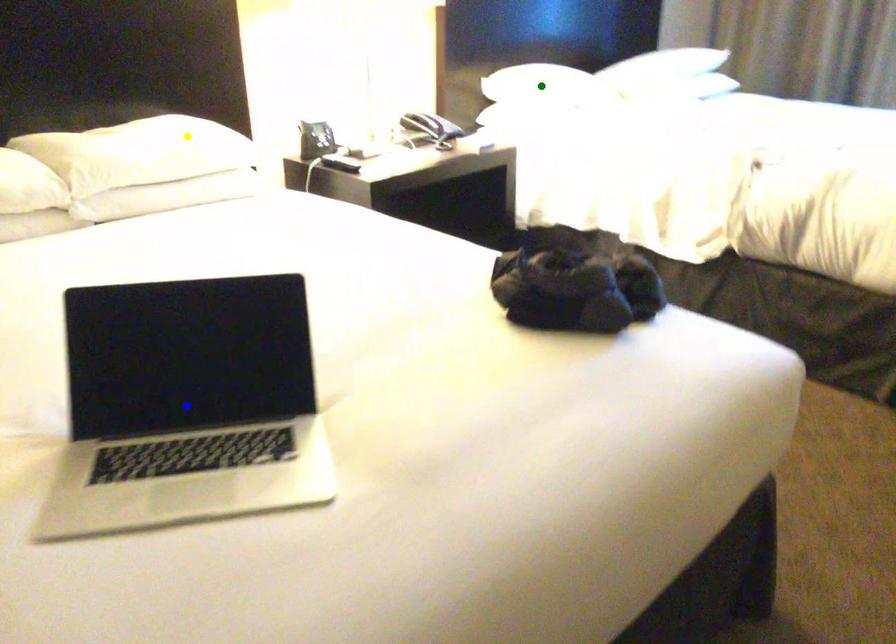
Order these from nearest to farthest:
yellow point | blue point | green point

1. blue point
2. yellow point
3. green point